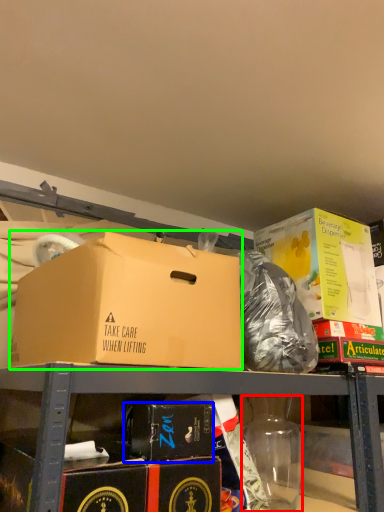
Question: Which is farther away from bottle (highlighted by a red box)? box (highlighted by a blue box) or box (highlighted by a green box)?

Choices:
 (A) box
 (B) box

Answer: (B)